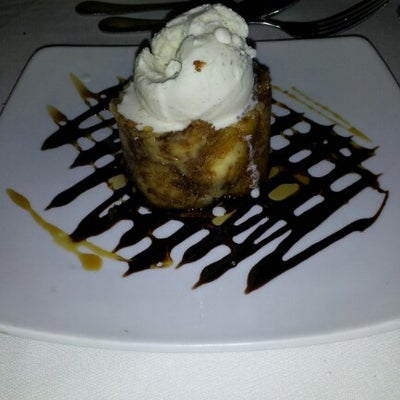
Locate an element on the screen. This screenshot has height=400, width=400. crumb is located at coordinates (199, 64).